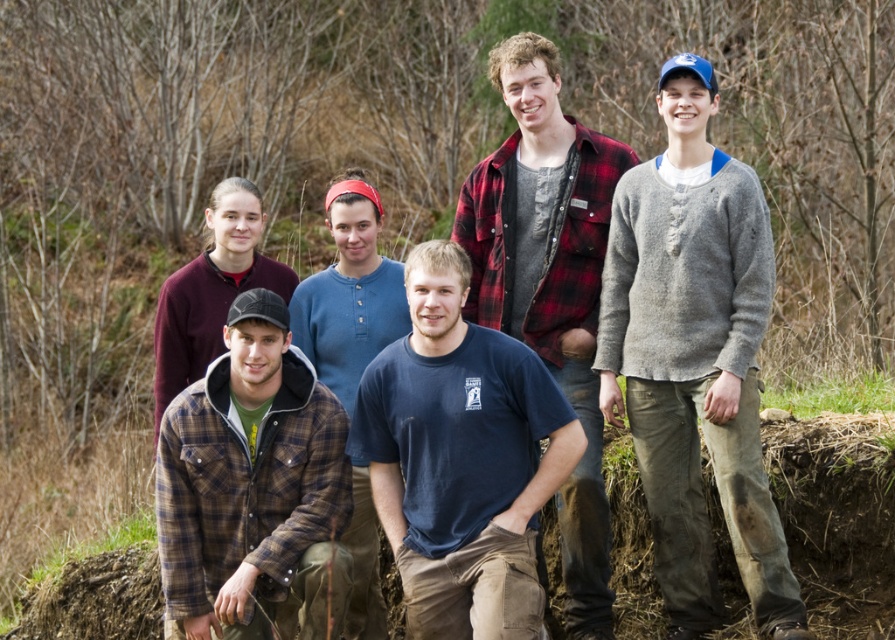
Consider the image. Who is positioned more to the right, dark blue t-shirt at center or plaid flannel shirt at lower left?

From the viewer's perspective, dark blue t-shirt at center appears more on the right side.

Is dark blue t-shirt at center below plaid flannel shirt at lower left?

Incorrect, dark blue t-shirt at center is not positioned below plaid flannel shirt at lower left.

This screenshot has height=640, width=895. I want to click on dark blue t-shirt at center, so click(x=461, y=458).

Who is lower down, gray wool sweater at center or plaid flannel shirt at lower left?

plaid flannel shirt at lower left is below.

Which of these two, gray wool sweater at center or plaid flannel shirt at lower left, stands taller?

Standing taller between the two is gray wool sweater at center.

The image size is (895, 640). Find the location of `gray wool sweater at center`. gray wool sweater at center is located at coordinates (695, 358).

Does gray wool sweater at center have a lesser height compared to plaid flannel shirt at center?

Yes.

Who is more distant from viewer, (761, 317) or (594, 132)?

The point (594, 132) is behind.

At what (x,y) coordinates should I click in order to perform the action: click on gray wool sweater at center. Please return your answer as a coordinate pair (x, y). This screenshot has width=895, height=640. Looking at the image, I should click on (695, 358).